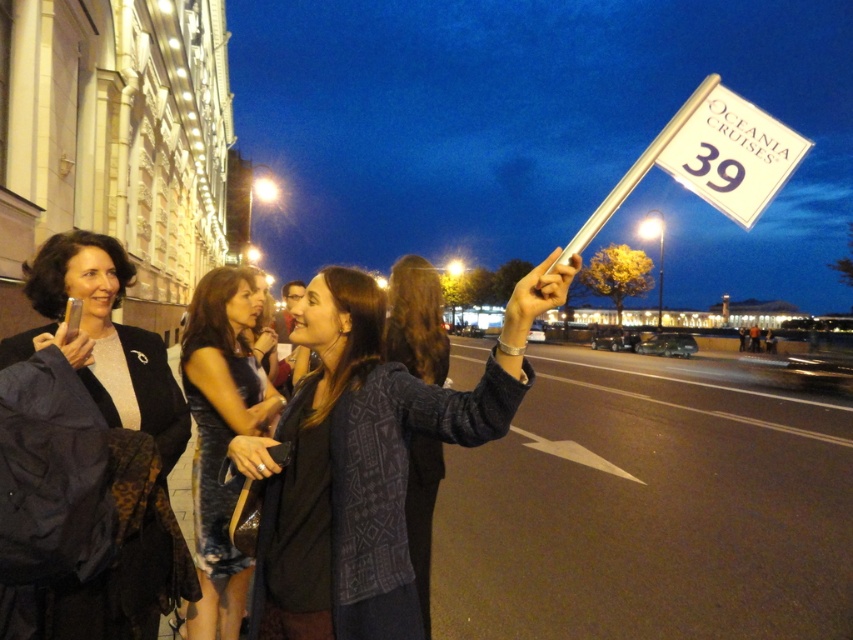
You are a pedestrian standing on the street looking towards the white paper flag at upper right and the knitted sweater at center. Which object is positioned higher in the scene?

The white paper flag at upper right is located above the knitted sweater at center, so it is positioned higher in the scene.

You are standing at the center of the street and want to find the matte black jacket at left. Which direction should you look to locate it?

The matte black jacket at left is located at point (105,337), so you should look to your left to find it.